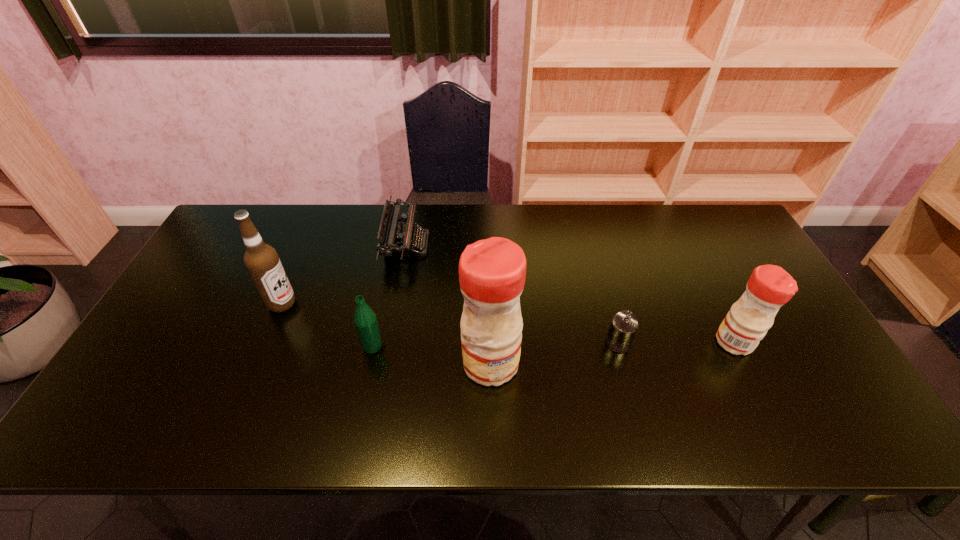
The width and height of the screenshot is (960, 540). What are the coordinates of `vacant region located on the back of the right condiment` in the screenshot? It's located at (681, 235).

You are a GUI agent. You are given a task and a screenshot of the screen. Output one action in this format:
    pyautogui.click(x=<x>, y=<y>)
    Task: Click on the vacant space located 0.340m on the typing side of the typewriter
    
    Given the screenshot: What is the action you would take?
    pyautogui.click(x=534, y=245)

Locate an element on the screen. free space located on the back of the second object from right to left is located at coordinates (611, 316).

In order to click on free space located on the right of the fourth tallest object in this screenshot , I will do `click(484, 346)`.

What are the coordinates of `vacant region located 0.360m on the label of the second tallest object` in the screenshot? It's located at (424, 303).

I want to click on object that is at the far edge, so click(395, 239).

This screenshot has width=960, height=540. What are the coordinates of `object that is at the near edge` in the screenshot? It's located at (492, 272).

This screenshot has width=960, height=540. Find the location of `object that is positioned at the right edge`. object that is positioned at the right edge is located at coordinates (769, 287).

Identify the location of blank space at the far edge of the desktop. (644, 241).

Where is `vacant space at the near edge of the desktop`? This screenshot has height=540, width=960. vacant space at the near edge of the desktop is located at coordinates (293, 398).